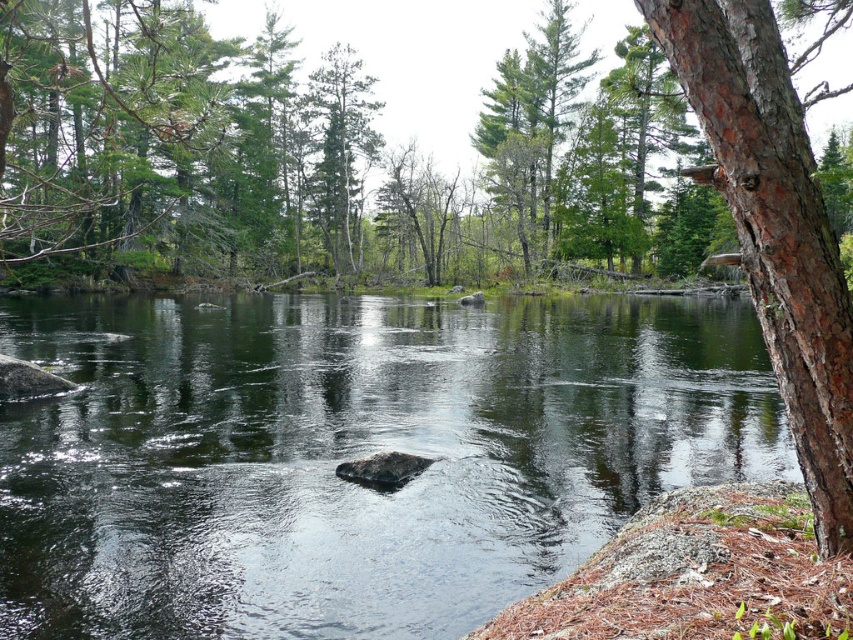
Question: Estimate the real-world distances between objects in this image. Which object is farther from the green matte tree at center?

Choices:
 (A) brown rough bark tree at right
 (B) transparent water at center

Answer: (A)

Question: Based on their relative distances, which object is nearer to the transparent water at center?

Choices:
 (A) brown rough bark tree at right
 (B) green matte tree at center

Answer: (A)

Question: Which object is farther from the camera taking this photo?

Choices:
 (A) green matte tree at center
 (B) transparent water at center

Answer: (A)

Question: Is transparent water at center in front of green matte tree at center?

Choices:
 (A) no
 (B) yes

Answer: (B)

Question: Where is transparent water at center located in relation to brown rough bark tree at right in the image?

Choices:
 (A) above
 (B) below

Answer: (B)

Question: Can you confirm if transparent water at center is wider than brown rough bark tree at right?

Choices:
 (A) yes
 (B) no

Answer: (A)